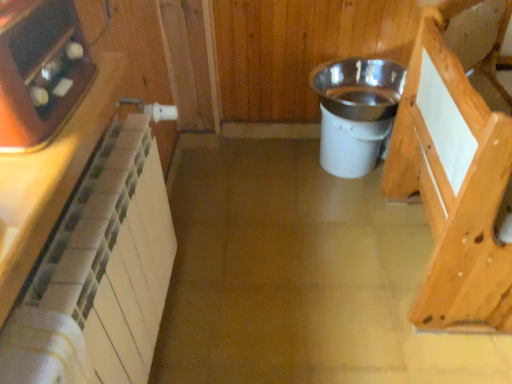
At what (x,y) coordinates should I click in order to perform the action: click on blank space above white tile cabinetry at left, which ranks as the first cabinetry in left-to-right order (from a real-world perspective). Please return your answer as a coordinate pair (x, y). Looking at the image, I should click on (49, 139).